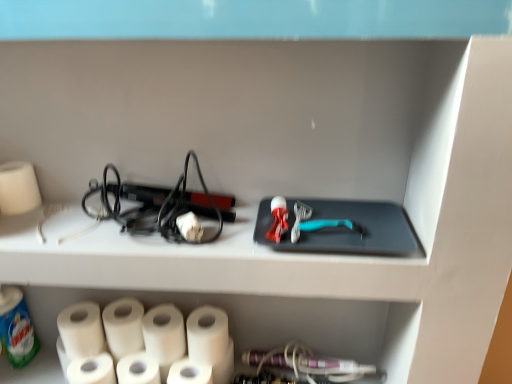
This screenshot has height=384, width=512. What do you see at coordinates (207, 335) in the screenshot? I see `white matte paper towel at lower center, the 1th paper towel when ordered from right to left` at bounding box center [207, 335].

Find the location of `white matte paper towel at lower left, the fourth paper towel in the right-to-left sequence`. white matte paper towel at lower left, the fourth paper towel in the right-to-left sequence is located at coordinates (138, 369).

Locate an element on the screen. The height and width of the screenshot is (384, 512). white matte toilet paper at lower left is located at coordinates (92, 370).

This screenshot has height=384, width=512. I want to click on white matte paper towel at lower left, marked as the 6th paper towel in a right-to-left arrangement, so click(x=81, y=330).

The height and width of the screenshot is (384, 512). Identify the location of white matte paper towel at lower left, which is the 5th paper towel in right-to-left order. click(123, 326).

At what (x,y) coordinates should I click in order to perform the action: click on white matte paper towel at lower center, the 1th paper towel when ordered from right to left. Please return your answer as a coordinate pair (x, y). The width and height of the screenshot is (512, 384). Looking at the image, I should click on (207, 335).

Based on the photo, which object is closer to the camera, white matte paper towel at lower left, which is the 5th paper towel in right-to-left order, or white matte paper towel at left, acting as the 7th paper towel starting from the right?

white matte paper towel at left, acting as the 7th paper towel starting from the right, is in front.

Which of these two, white matte paper towel at lower left, which is the 5th paper towel in right-to-left order, or white matte paper towel at left, the 1th paper towel from the left, is wider?

Wider between the two is white matte paper towel at lower left, which is the 5th paper towel in right-to-left order.

Between white matte paper towel at lower left, the 3th paper towel positioned from the left, and white matte paper towel at left, the 1th paper towel from the left, which one has smaller size?

white matte paper towel at left, the 1th paper towel from the left, is smaller.

The height and width of the screenshot is (384, 512). I want to click on the 6th paper towel in front of the white matte paper towel at lower left, which is the 5th paper towel in right-to-left order, counting from the anchor's position, so click(x=18, y=188).

Could you tell me if white matte paper towel at lower left, the fourth paper towel in the right-to-left sequence, is turned towards white matte paper towel at lower left, marked as the 6th paper towel in a right-to-left arrangement?

No, white matte paper towel at lower left, the fourth paper towel in the right-to-left sequence, is not turned towards white matte paper towel at lower left, marked as the 6th paper towel in a right-to-left arrangement.

From a real-world perspective, which object stands above the other?

white matte paper towel at lower left, which is the 2th paper towel in left-to-right order.

Is white matte paper towel at lower left, the fourth paper towel in the right-to-left sequence, at the left side of white matte paper towel at lower left, marked as the 6th paper towel in a right-to-left arrangement?

No.

Is white matte paper towel at lower left, marked as the 4th paper towel in a left-to-right arrangement, wider than white matte paper towel at lower center, the 1th paper towel when ordered from right to left?

In fact, white matte paper towel at lower left, marked as the 4th paper towel in a left-to-right arrangement, might be narrower than white matte paper towel at lower center, the 1th paper towel when ordered from right to left.

In the image, is white matte paper towel at lower left, the fourth paper towel in the right-to-left sequence, positioned in front of or behind white matte paper towel at lower center, the 1th paper towel when ordered from right to left?

In the image, white matte paper towel at lower left, the fourth paper towel in the right-to-left sequence, appears in front of white matte paper towel at lower center, the 1th paper towel when ordered from right to left.

Is white matte paper towel at lower left, the fourth paper towel in the right-to-left sequence, inside the boundaries of white matte paper towel at lower center, the 1th paper towel when ordered from right to left, or outside?

white matte paper towel at lower left, the fourth paper towel in the right-to-left sequence, is not inside white matte paper towel at lower center, the 1th paper towel when ordered from right to left, it's outside.

Which paper towel is the 3rd one when counting from the right side of the white matte paper towel at lower left, marked as the 4th paper towel in a left-to-right arrangement? Please provide its 2D coordinates.

[(207, 335)]

From the image's perspective, is white matte toilet paper at lower left located above white matte paper towel at left, acting as the 7th paper towel starting from the right?

Incorrect, from the image's perspective, white matte toilet paper at lower left is lower than white matte paper towel at left, acting as the 7th paper towel starting from the right.

Is white matte toilet paper at lower left smaller than white matte paper towel at left, acting as the 7th paper towel starting from the right?

No, white matte toilet paper at lower left is not smaller than white matte paper towel at left, acting as the 7th paper towel starting from the right.

Is white matte toilet paper at lower left completely or partially outside of white matte paper towel at left, the 1th paper towel from the left?

Indeed, white matte toilet paper at lower left is completely outside white matte paper towel at left, the 1th paper towel from the left.

Between white matte toilet paper at lower left and white matte paper towel at left, the 1th paper towel from the left, which one has more height?

white matte toilet paper at lower left.

Is white matte paper towel at lower left, marked as the 6th paper towel in a right-to-left arrangement, looking in the opposite direction of white matte paper towel at lower left, marked as the 4th paper towel in a left-to-right arrangement?

No, white matte paper towel at lower left, marked as the 6th paper towel in a right-to-left arrangement, is not facing the opposite direction of white matte paper towel at lower left, marked as the 4th paper towel in a left-to-right arrangement.

Is point (101, 340) closer to camera compared to point (158, 376)?

No, it is behind (158, 376).

Is white matte paper towel at lower left, the fourth paper towel in the right-to-left sequence, located within white matte paper towel at lower left, marked as the 6th paper towel in a right-to-left arrangement?

Definitely not — white matte paper towel at lower left, the fourth paper towel in the right-to-left sequence, is not inside white matte paper towel at lower left, marked as the 6th paper towel in a right-to-left arrangement.

How much distance is there between white matte paper towel at lower left, which is the 2th paper towel in left-to-right order, and white matte paper towel at lower left, the fourth paper towel in the right-to-left sequence?

white matte paper towel at lower left, which is the 2th paper towel in left-to-right order, is 4.78 inches from white matte paper towel at lower left, the fourth paper towel in the right-to-left sequence.

Consider the image. Is white matte paper towel at lower center, the 1th paper towel when ordered from right to left, wider than white matte paper towel at lower left, the 3th paper towel positioned from the left?

Yes.

There is a white matte paper towel at lower center, which is the 7th paper towel in left-to-right order. Identify the location of the 3rd paper towel above it (from the image's perspective). (123, 326).

Does point (195, 319) lie in front of point (119, 308)?

Yes, it is.

Is white matte paper towel at lower center, the 1th paper towel when ordered from right to left, far away from white matte paper towel at lower left, which is the 5th paper towel in right-to-left order?

No, there isn't a large distance between white matte paper towel at lower center, the 1th paper towel when ordered from right to left, and white matte paper towel at lower left, which is the 5th paper towel in right-to-left order.

Which object is wider, white matte toilet paper at lower left or white matte paper towel at lower left, the fourth paper towel in the right-to-left sequence?

white matte paper towel at lower left, the fourth paper towel in the right-to-left sequence, is wider.

Is white matte toilet paper at lower left looking in the opposite direction of white matte paper towel at lower left, the fourth paper towel in the right-to-left sequence?

That's not correct — white matte toilet paper at lower left is not looking away from white matte paper towel at lower left, the fourth paper towel in the right-to-left sequence.

Which object is closer to the camera taking this photo, white matte toilet paper at lower left or white matte paper towel at lower left, marked as the 4th paper towel in a left-to-right arrangement?

white matte toilet paper at lower left.

From the white matte paper towel at lower left, which is the 5th paper towel in right-to-left order, count the 2nd paper towel to the left and point to it. Please provide its 2D coordinates.

[(18, 188)]

Starting from the white matte paper towel at lower left, marked as the 6th paper towel in a right-to-left arrangement, which paper towel is the 3rd one in front? Please provide its 2D coordinates.

[(138, 369)]

Estimate the real-world distances between objects in this image. Which object is closer to white matte paper towel at lower left, which is the 5th paper towel in right-to-left order, white matte paper towel at lower center, the 6th paper towel viewed from the left, or white matte paper towel at lower center, arranged as the fifth paper towel when viewed from the left?

white matte paper towel at lower center, arranged as the fifth paper towel when viewed from the left, lies closer to white matte paper towel at lower left, which is the 5th paper towel in right-to-left order, than the other object.

Estimate the real-world distances between objects in this image. Which object is further from white matte paper towel at lower center, which is the 7th paper towel in left-to-right order, white matte paper towel at lower center, the 6th paper towel viewed from the left, or white matte paper towel at lower left, the 3th paper towel positioned from the left?

white matte paper towel at lower left, the 3th paper towel positioned from the left.

Based on their spatial positions, is white matte paper towel at lower left, the fourth paper towel in the right-to-left sequence, or white matte toilet paper at lower left further from white matte paper towel at lower left, marked as the 6th paper towel in a right-to-left arrangement?

white matte paper towel at lower left, the fourth paper towel in the right-to-left sequence, lies further to white matte paper towel at lower left, marked as the 6th paper towel in a right-to-left arrangement, than the other object.

Considering their positions, is white matte paper towel at lower left, marked as the 6th paper towel in a right-to-left arrangement, positioned further to white matte paper towel at lower center, which is the 7th paper towel in left-to-right order, than white matte paper towel at left, acting as the 7th paper towel starting from the right?

The object further to white matte paper towel at lower center, which is the 7th paper towel in left-to-right order, is white matte paper towel at left, acting as the 7th paper towel starting from the right.

Consider the image. From the image, which object appears to be nearer to white matte paper towel at lower left, the fourth paper towel in the right-to-left sequence, white matte paper towel at lower center, the 6th paper towel viewed from the left, or white matte paper towel at lower left, the 3th paper towel positioned from the left?

white matte paper towel at lower left, the 3th paper towel positioned from the left, is closer to white matte paper towel at lower left, the fourth paper towel in the right-to-left sequence.

Based on their spatial positions, is white matte paper towel at lower left, which is the 2th paper towel in left-to-right order, or white matte paper towel at left, acting as the 7th paper towel starting from the right, closer to white matte paper towel at lower left, which is the 5th paper towel in right-to-left order?

white matte paper towel at lower left, which is the 2th paper towel in left-to-right order.

Considering their positions, is white matte paper towel at left, acting as the 7th paper towel starting from the right, positioned closer to white matte paper towel at lower center, the third paper towel from the right, than white matte paper towel at lower left, marked as the 4th paper towel in a left-to-right arrangement?

white matte paper towel at lower left, marked as the 4th paper towel in a left-to-right arrangement, is closer to white matte paper towel at lower center, the third paper towel from the right.

Considering their positions, is white matte paper towel at lower center, which is the 7th paper towel in left-to-right order, positioned further to white matte toilet paper at lower left than white matte paper towel at left, the 1th paper towel from the left?

white matte paper towel at left, the 1th paper towel from the left, is further to white matte toilet paper at lower left.

You are a GUI agent. You are given a task and a screenshot of the screen. Output one action in this format:
    pyautogui.click(x=<x>, y=<y>)
    Task: Click on the paper towel between white matte paper towel at lower left, the fourth paper towel in the right-to-left sequence, and white matte paper towel at lower center, which ranks as the second paper towel in right-to-left order, from left to right
    
    Given the screenshot: What is the action you would take?
    pyautogui.click(x=164, y=334)

Find the location of a particular element. The height and width of the screenshot is (384, 512). paper towel between white matte paper towel at lower left, which is the 2th paper towel in left-to-right order, and white matte paper towel at lower left, the fourth paper towel in the right-to-left sequence, from left to right is located at coordinates (123, 326).

Find the location of a particular element. This screenshot has height=384, width=512. paper towel between white matte paper towel at left, acting as the 7th paper towel starting from the right, and white matte paper towel at lower left, marked as the 6th paper towel in a right-to-left arrangement, from top to bottom is located at coordinates (123, 326).

I want to click on toilet paper between white matte paper towel at lower left, marked as the 6th paper towel in a right-to-left arrangement, and white matte paper towel at lower center, the 6th paper towel viewed from the left, in the horizontal direction, so click(x=92, y=370).